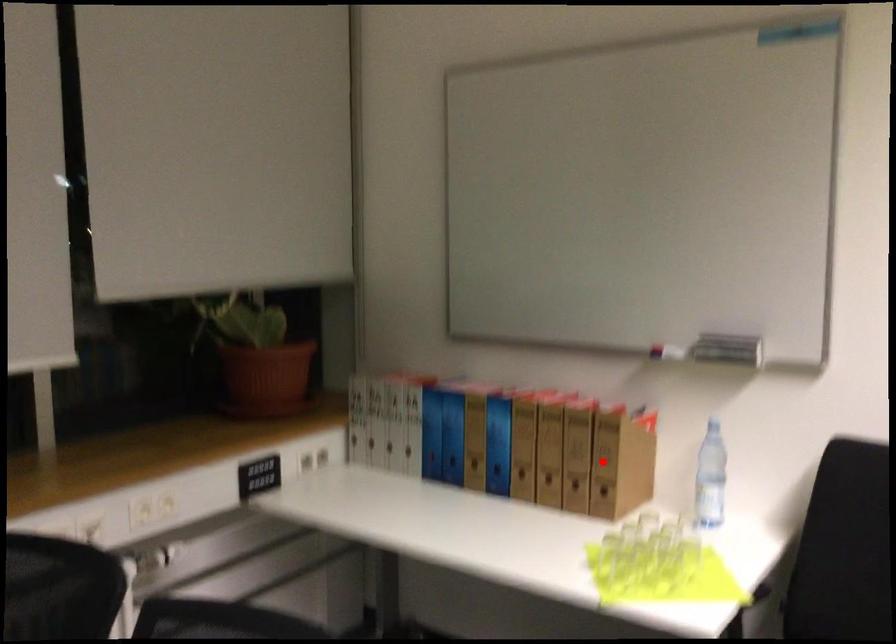
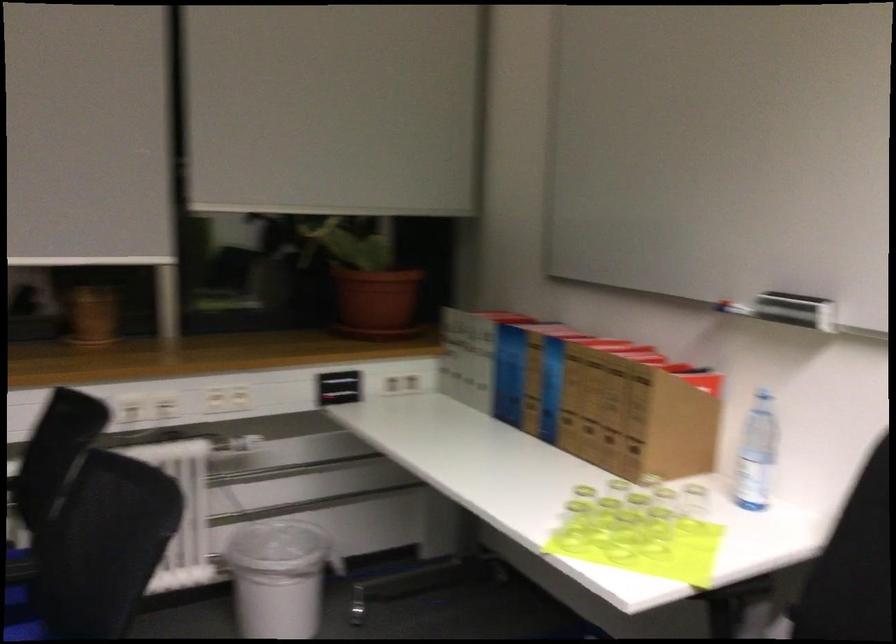
Find the pixel in the second image that matches the highlighted location in the first image.

(634, 417)